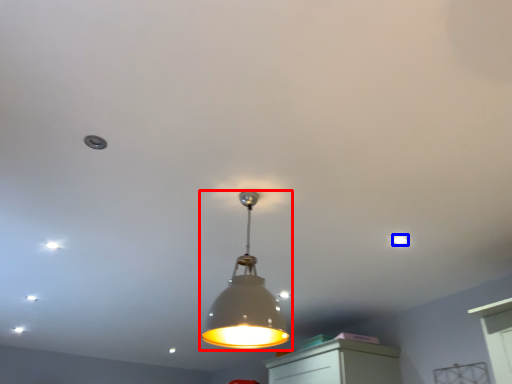
Question: Which object is further to the camera taking this photo, lamp (highlighted by a red box) or dot (highlighted by a blue box)?

Choices:
 (A) lamp
 (B) dot

Answer: (B)